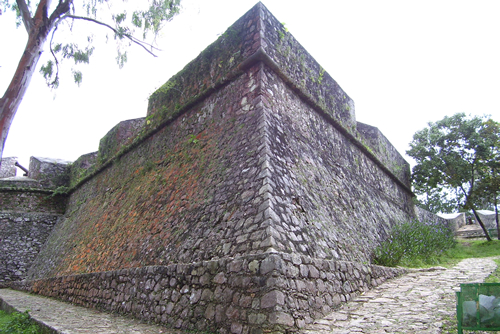
What are the coordinates of `trash` in the screenshot? It's located at (482, 311).